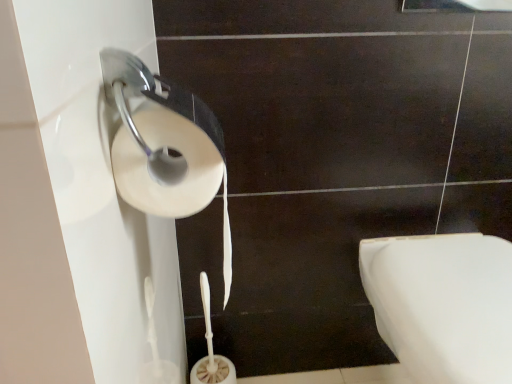
What are the coordinates of `white glossy toilet at lower right` in the screenshot? It's located at (443, 304).

Measure the distance between white glossy toilet at lower right and camera.

23.72 inches.

What do you see at coordinates (443, 304) in the screenshot? The image size is (512, 384). I see `white glossy toilet at lower right` at bounding box center [443, 304].

Identify the location of white matte toilet paper at left. Image resolution: width=512 pixels, height=384 pixels. (164, 146).

This screenshot has width=512, height=384. What do you see at coordinates (164, 146) in the screenshot?
I see `white matte toilet paper at left` at bounding box center [164, 146].

Find the location of a particular element. The height and width of the screenshot is (384, 512). white glossy toilet at lower right is located at coordinates tap(443, 304).

Does white matte toilet paper at left appear on the left side of white glossy toilet at lower right?

Yes.

Considering the positions of objects white matte toilet paper at left and white glossy toilet at lower right in the image provided, who is behind, white matte toilet paper at left or white glossy toilet at lower right?

white glossy toilet at lower right is more distant.

Which is nearer, [145,133] or [392,249]?

Point [145,133] appears to be closer to the viewer than point [392,249].

From the image's perspective, is white matte toilet paper at left below white glossy toilet at lower right?

Incorrect, from the image's perspective, white matte toilet paper at left is higher than white glossy toilet at lower right.

From a real-world perspective, who is located lower, white matte toilet paper at left or white glossy toilet at lower right?

white glossy toilet at lower right, from a real-world perspective.

Between white matte toilet paper at left and white glossy toilet at lower right, which one has larger width?

With larger width is white glossy toilet at lower right.

Can you confirm if white matte toilet paper at left is taller than white glossy toilet at lower right?

No, white matte toilet paper at left is not taller than white glossy toilet at lower right.

Based on their sizes in the image, would you say white matte toilet paper at left is bigger or smaller than white glossy toilet at lower right?

Considering their sizes, white matte toilet paper at left takes up less space than white glossy toilet at lower right.

Is white matte toilet paper at left not inside white glossy toilet at lower right?

Yes, white matte toilet paper at left is located beyond the bounds of white glossy toilet at lower right.

Is white matte toilet paper at left positioned far away from white glossy toilet at lower right?

That's not correct — white matte toilet paper at left is a little close to white glossy toilet at lower right.

Is white matte toilet paper at left looking in the opposite direction of white glossy toilet at lower right?

No, white matte toilet paper at left is not facing the opposite direction of white glossy toilet at lower right.

How many degrees apart are the facing directions of white matte toilet paper at left and white glossy toilet at lower right?

The angular difference between white matte toilet paper at left and white glossy toilet at lower right is 3.5 degrees.

How much distance is there between white matte toilet paper at left and white glossy toilet at lower right?

white matte toilet paper at left is 21.86 inches away from white glossy toilet at lower right.

Locate an element on the screen. toilet paper on the left of the white glossy toilet at lower right is located at coordinates (164, 146).

Which object is positioned more to the right, white glossy toilet at lower right or white matte toilet paper at left?

white glossy toilet at lower right is more to the right.

Which object is closer to the camera, white glossy toilet at lower right or white matte toilet paper at left?

Positioned in front is white matte toilet paper at left.

Does point (489, 275) appear closer or farther from the camera than point (183, 199)?

Point (489, 275) appears to be farther away from the viewer than point (183, 199).

From the image's perspective, is white glossy toilet at lower right above or below white matte toilet paper at left?

Clearly, from the image's perspective, white glossy toilet at lower right is below white matte toilet paper at left.

From a real-world perspective, is white glossy toilet at lower right positioned above or below white matte toilet paper at left?

In terms of real-world spatial position, white glossy toilet at lower right is below white matte toilet paper at left.

Looking at this image, between white glossy toilet at lower right and white matte toilet paper at left, which one has smaller width?

Thinner between the two is white matte toilet paper at left.

Considering the sizes of objects white glossy toilet at lower right and white matte toilet paper at left in the image provided, who is shorter, white glossy toilet at lower right or white matte toilet paper at left?

white matte toilet paper at left is shorter.

Based on their sizes in the image, would you say white glossy toilet at lower right is bigger or smaller than white matte toilet paper at left?

In the image, white glossy toilet at lower right appears to be larger than white matte toilet paper at left.

Does white glossy toilet at lower right contain white matte toilet paper at left?

Actually, white matte toilet paper at left is outside white glossy toilet at lower right.

Is there a large distance between white glossy toilet at lower right and white matte toilet paper at left?

That's not correct — white glossy toilet at lower right is a little close to white matte toilet paper at left.

In the scene shown: Is white glossy toilet at lower right facing towards white matte toilet paper at left?

No, white glossy toilet at lower right is not turned towards white matte toilet paper at left.

What's the angular difference between white glossy toilet at lower right and white matte toilet paper at left's facing directions?

The angle between the facing direction of white glossy toilet at lower right and the facing direction of white matte toilet paper at left is 3.5 degrees.

Locate an element on the screen. The image size is (512, 384). toilet below the white matte toilet paper at left (from the image's perspective) is located at coordinates (443, 304).

The image size is (512, 384). Find the location of `toilet on the right of white matte toilet paper at left`. toilet on the right of white matte toilet paper at left is located at coordinates (443, 304).

Find the location of a particular element. The width and height of the screenshot is (512, 384). toilet paper on the left side of white glossy toilet at lower right is located at coordinates (164, 146).